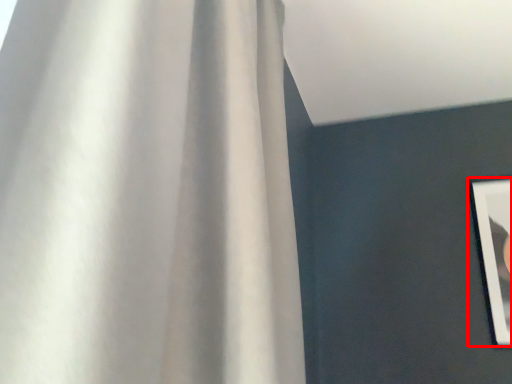
Question: From the image's perspective, considering the relative positions of picture frame (annotated by the red box) and curtain in the image provided, where is picture frame (annotated by the red box) located with respect to the staircase?

Choices:
 (A) below
 (B) above

Answer: (A)